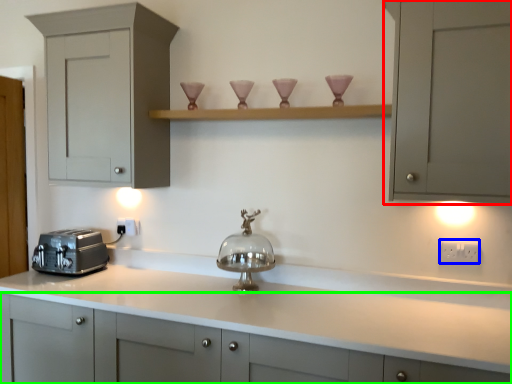
Question: Which object is the farthest from cabinetry (highlighted by a red box)? Choose among these: electric outlet (highlighted by a blue box) or cabinetry (highlighted by a green box).

Choices:
 (A) electric outlet
 (B) cabinetry

Answer: (B)